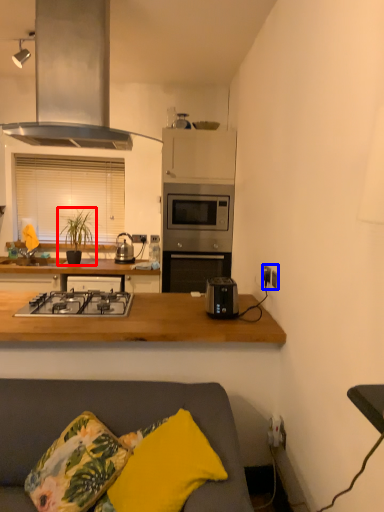
Question: Which object appears farthest to the camera in this image, houseplant (highlighted by a red box) or electric outlet (highlighted by a blue box)?

Choices:
 (A) houseplant
 (B) electric outlet

Answer: (A)